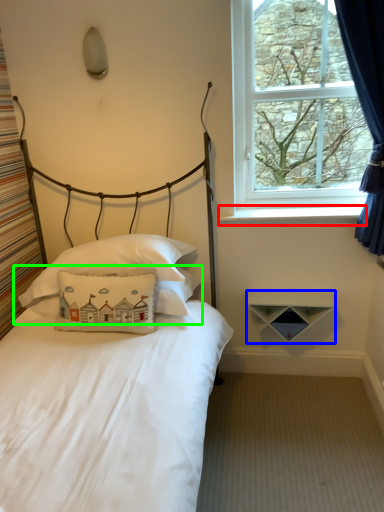
Question: Based on their relative distances, which object is nearer to window sill (highlighted by a red box)? Choose from shelf (highlighted by a blue box) and pillow (highlighted by a green box).

Choices:
 (A) shelf
 (B) pillow

Answer: (A)